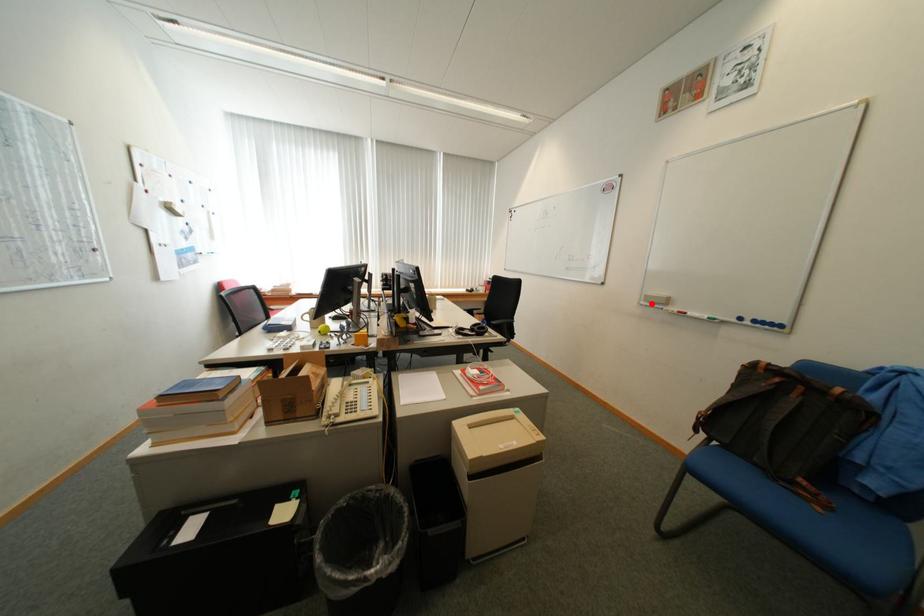
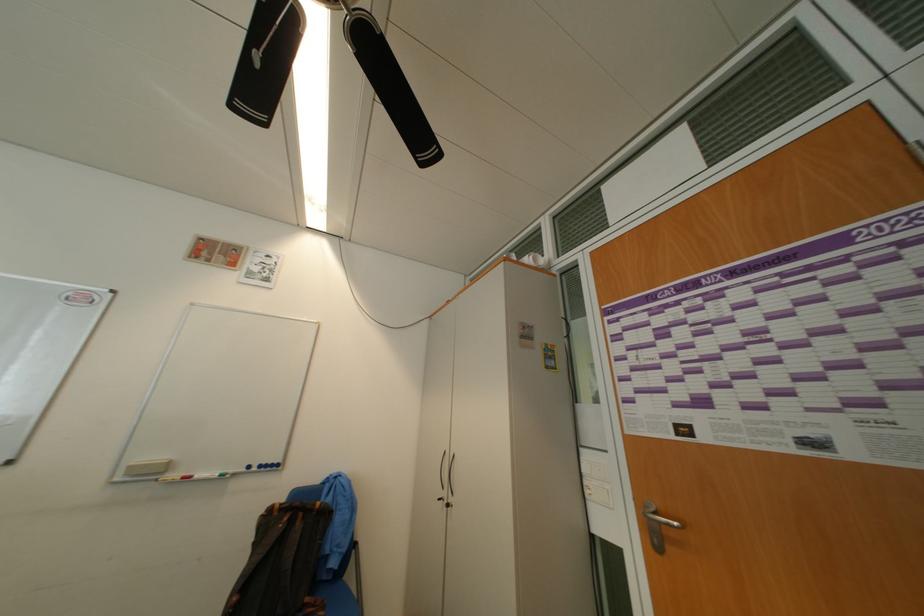
Locate, in the second image, the point that corresponds to the highlighted location in the first image.

(128, 480)